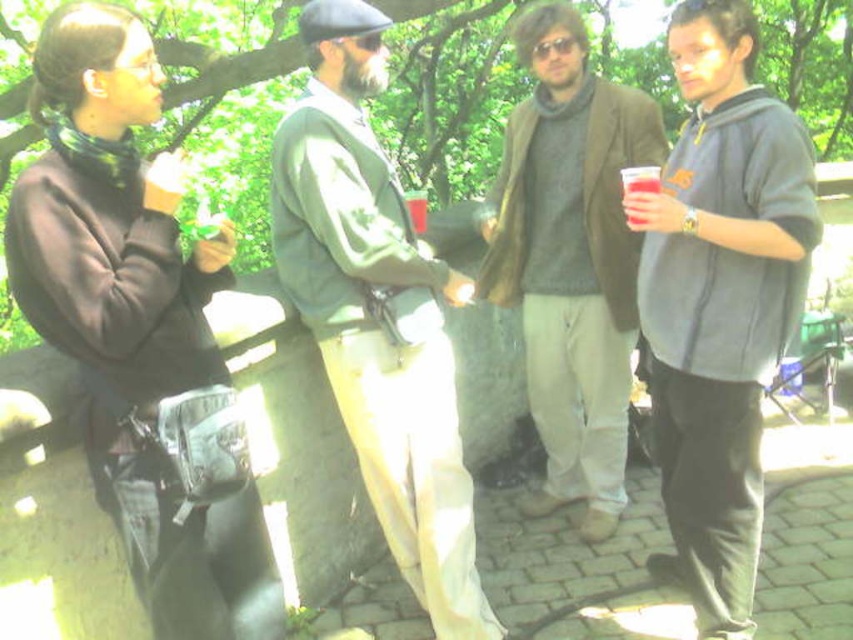
Question: Which point is closer to the camera?

Choices:
 (A) translucent plastic cup at center
 (B) translucent plastic cup at right

Answer: (B)

Question: Which object is farther from the camera taking this photo?

Choices:
 (A) green fabric jacket at center
 (B) matte plastic cup at upper left

Answer: (A)

Question: Does green fabric jacket at center have a lesser width compared to matte plastic cup at upper left?

Choices:
 (A) yes
 (B) no

Answer: (B)

Question: Is knit sweater at center in front of matte plastic cup at upper left?

Choices:
 (A) no
 (B) yes

Answer: (A)

Question: Does knit sweater at center appear under matte plastic cup at upper left?

Choices:
 (A) no
 (B) yes

Answer: (B)

Question: Which point is closer to the camera taking this photo?

Choices:
 (A) (418, 225)
 (B) (434, 426)
 (C) (556, 156)

Answer: (B)